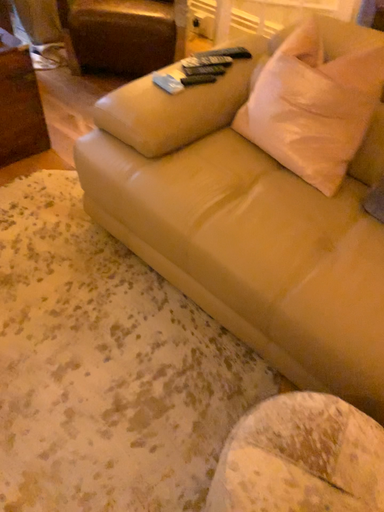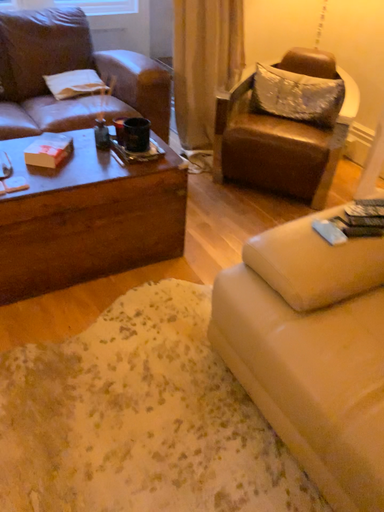
Question: Which way did the camera rotate in the video?

Choices:
 (A) rotated right
 (B) rotated left

Answer: (B)